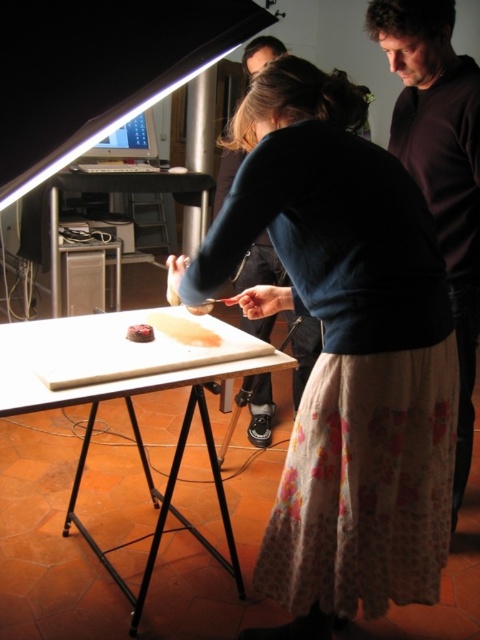
Question: Which object is the closest to the dark brown sweater at upper right?

Choices:
 (A) chocolate cake at center
 (B) dark brown leather jacket at upper center
 (C) matte blue sweater at center

Answer: (C)

Question: Which point is closer to the camera?

Choices:
 (A) brown matte cake at center
 (B) chocolate cake at center
 (C) matte blue sweater at center

Answer: (C)

Question: Does white matte table at center lie behind chocolate cake at center?

Choices:
 (A) no
 (B) yes

Answer: (A)

Question: Can you confirm if matte blue sweater at center is wider than white matte table at center?

Choices:
 (A) yes
 (B) no

Answer: (B)

Question: Is white matte table at center closer to the viewer compared to dark brown leather jacket at upper center?

Choices:
 (A) no
 (B) yes

Answer: (B)

Question: Which object is farther from the camera taking this photo?

Choices:
 (A) matte blue sweater at center
 (B) dark brown leather jacket at upper center

Answer: (B)